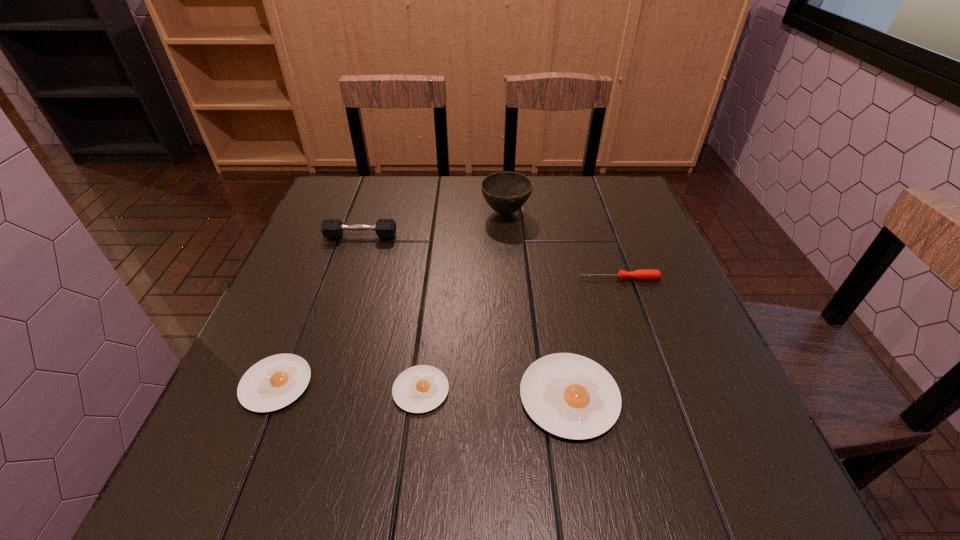
In order to click on the leftmost egg yolk in this screenshot , I will do `click(276, 381)`.

You are a GUI agent. You are given a task and a screenshot of the screen. Output one action in this format:
    pyautogui.click(x=<x>, y=<y>)
    Task: Click on the second tallest egg yolk
    The height and width of the screenshot is (540, 960).
    Given the screenshot: What is the action you would take?
    pyautogui.click(x=276, y=381)

Locate an element on the screen. the second egg yolk from right to left is located at coordinates (422, 388).

I want to click on the fourth object from right to left, so tap(422, 388).

Identify the location of the rightmost egg yolk. The height and width of the screenshot is (540, 960). (571, 396).

The image size is (960, 540). Identify the location of the third farthest object. (645, 274).

Identify the location of bowl. click(x=506, y=192).

This screenshot has height=540, width=960. I want to click on the farthest object, so click(506, 192).

I want to click on the second tallest object, so click(x=331, y=228).

The height and width of the screenshot is (540, 960). What are the coordinates of `dumbbell` in the screenshot? It's located at (331, 228).